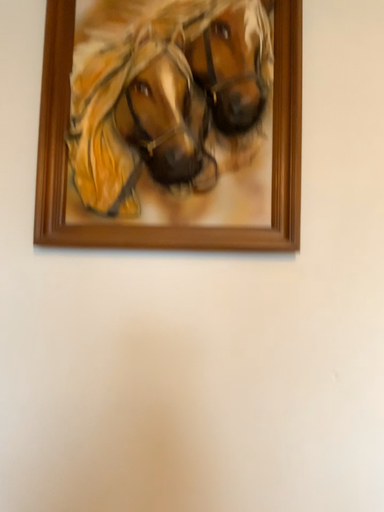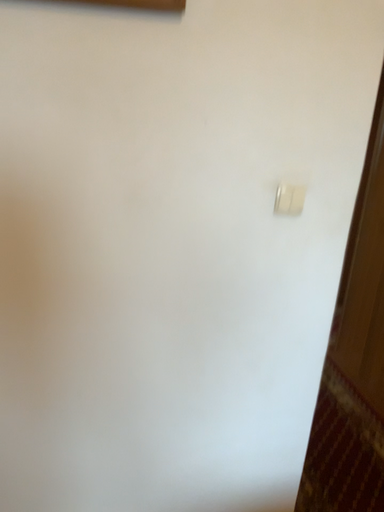
Question: How did the camera likely rotate when shooting the video?

Choices:
 (A) rotated left
 (B) rotated right

Answer: (B)